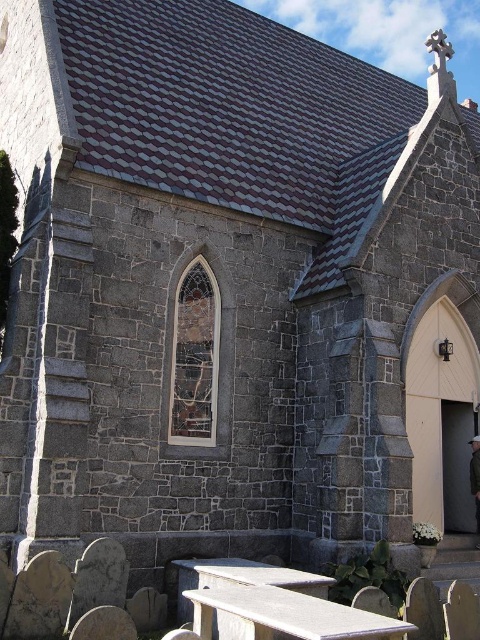
Question: Which object is positioned closest to the dark brown leather jacket at lower right?

Choices:
 (A) smooth gray bench at lower center
 (B) smooth gray picnic table at lower center

Answer: (B)

Question: Is smooth gray bench at lower center below dark brown leather jacket at lower right?

Choices:
 (A) yes
 (B) no

Answer: (A)

Question: Is smooth gray bench at lower center thinner than dark brown leather jacket at lower right?

Choices:
 (A) no
 (B) yes

Answer: (A)

Question: Is smooth gray bench at lower center below smooth gray picnic table at lower center?

Choices:
 (A) yes
 (B) no

Answer: (B)

Question: Which object is the closest to the dark brown leather jacket at lower right?

Choices:
 (A) smooth gray picnic table at lower center
 (B) smooth gray bench at lower center

Answer: (A)

Question: Which of the following is the farthest from the observer?

Choices:
 (A) smooth gray picnic table at lower center
 (B) smooth gray bench at lower center

Answer: (A)